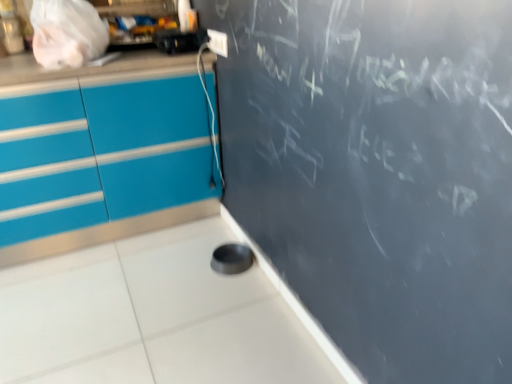
Question: From a real-world perspective, is white plastic electric outlet at upper center positioned above or below black plastic toaster at upper left?

Choices:
 (A) above
 (B) below

Answer: (B)

Question: Is white plastic electric outlet at upper center in front of or behind black plastic toaster at upper left in the image?

Choices:
 (A) front
 (B) behind

Answer: (B)

Question: Considering the positions of point (209, 31) and point (206, 39), is point (209, 31) closer or farther from the camera than point (206, 39)?

Choices:
 (A) closer
 (B) farther

Answer: (A)

Question: Is black plastic toaster at upper left taller or shorter than white plastic electric outlet at upper center?

Choices:
 (A) tall
 (B) short

Answer: (A)

Question: Is point (182, 44) closer or farther from the camera than point (218, 49)?

Choices:
 (A) farther
 (B) closer

Answer: (A)

Question: Looking at their shapes, would you say black plastic toaster at upper left is wider or thinner than white plastic electric outlet at upper center?

Choices:
 (A) wide
 (B) thin

Answer: (A)

Question: From the image's perspective, relative to white plastic electric outlet at upper center, is black plastic toaster at upper left above or below?

Choices:
 (A) above
 (B) below

Answer: (A)